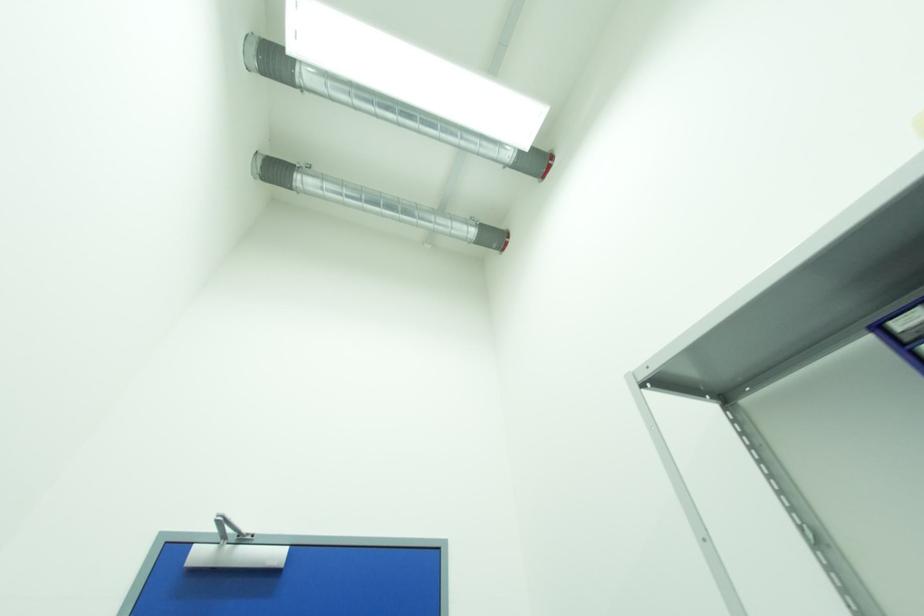
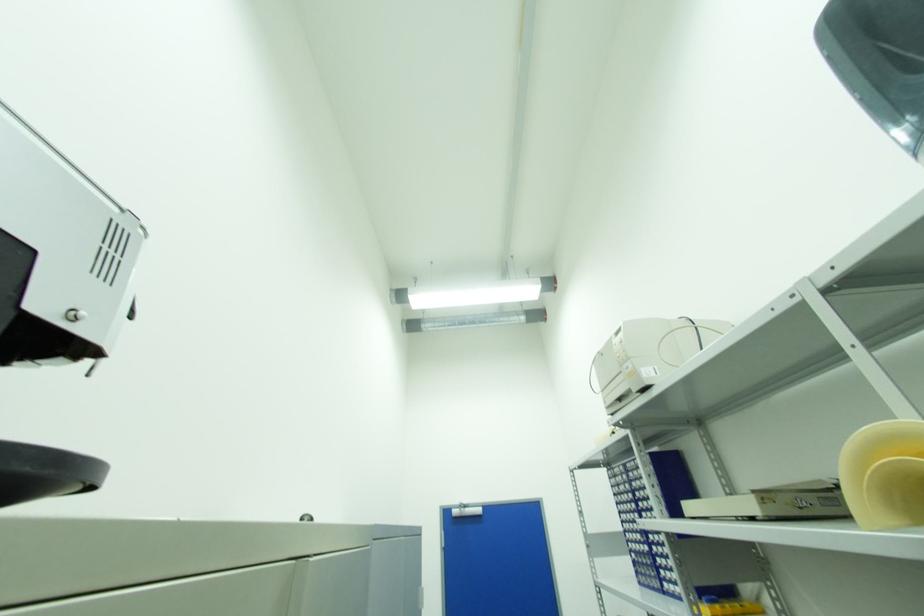
Looking at this image, in a continuous first-person perspective shot, in which direction is the camera moving?

The cameraman moved toward right, backward.